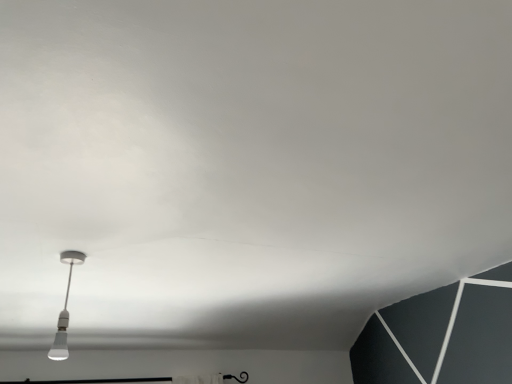
What are the coordinates of `white glossy light bulb at lower left` in the screenshot? It's located at (65, 309).

What is the approximate height of white glossy light bulb at lower left?

13.80 inches.

This screenshot has height=384, width=512. What do you see at coordinates (65, 309) in the screenshot?
I see `white glossy light bulb at lower left` at bounding box center [65, 309].

Where is `white glossy light bulb at lower left`? This screenshot has height=384, width=512. white glossy light bulb at lower left is located at coordinates (65, 309).